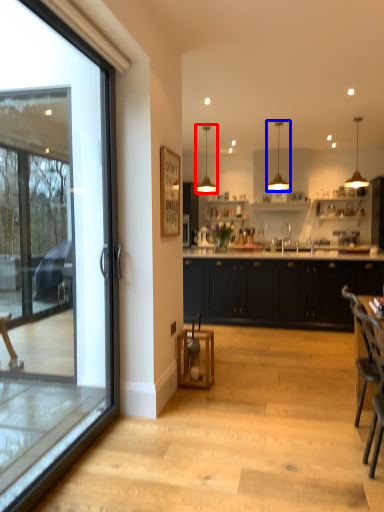
Question: Which object appears farthest to the camera in this image, lamp (highlighted by a red box) or lamp (highlighted by a blue box)?

Choices:
 (A) lamp
 (B) lamp

Answer: (A)